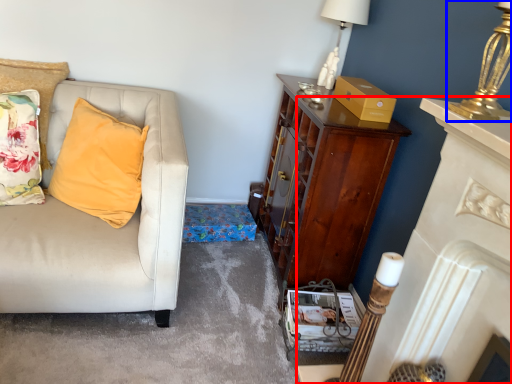
Question: Among these objects, which one is nearest to the camera, fireplace (highlighted by a red box) or lamp (highlighted by a blue box)?

Choices:
 (A) fireplace
 (B) lamp

Answer: (A)